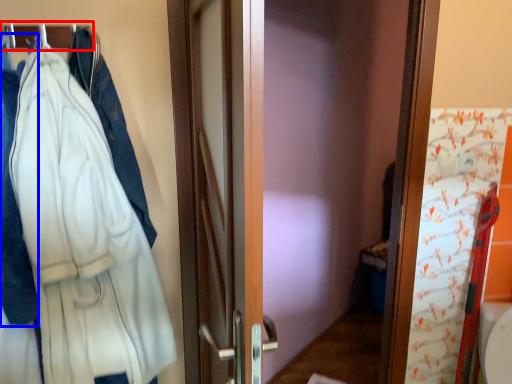
Question: Which point is further to the camera, hanger (highlighted by a red box) or garment (highlighted by a blue box)?

Choices:
 (A) hanger
 (B) garment

Answer: (A)